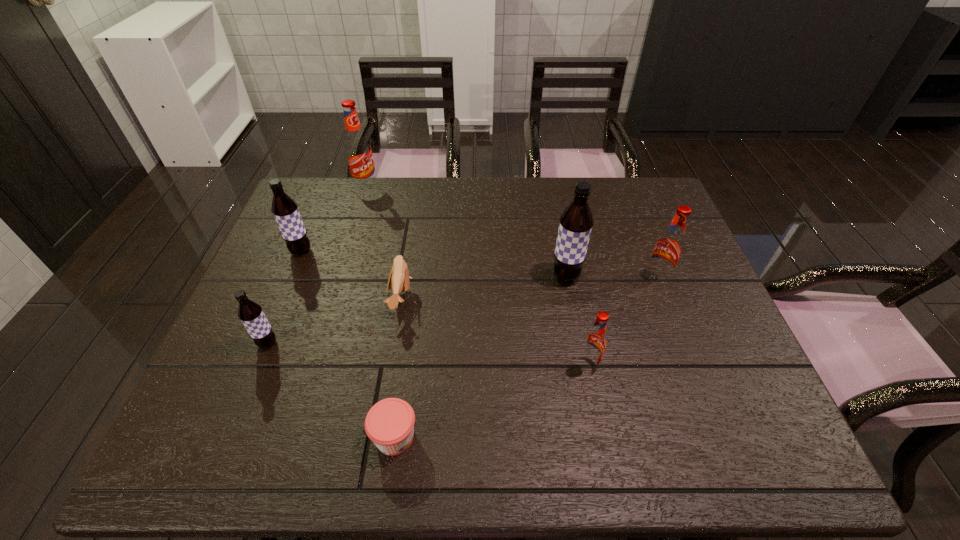
Find the location of `free spot that satisfies the following two spatial constraints: 1. on the front side of the second nearest object; 2. on the right side of the second nearest root beer`. free spot that satisfies the following two spatial constraints: 1. on the front side of the second nearest object; 2. on the right side of the second nearest root beer is located at coordinates (259, 365).

Image resolution: width=960 pixels, height=540 pixels. Identify the location of free region that satisfies the following two spatial constraints: 1. on the front side of the rightmost root beer; 2. on the left side of the rightmost brown root beer. (566, 279).

Image resolution: width=960 pixels, height=540 pixels. In order to click on vacant point that satisfies the following two spatial constraints: 1. on the front side of the second farthest root beer; 2. on the left side of the second nearest red root beer in this screenshot , I will do `click(290, 279)`.